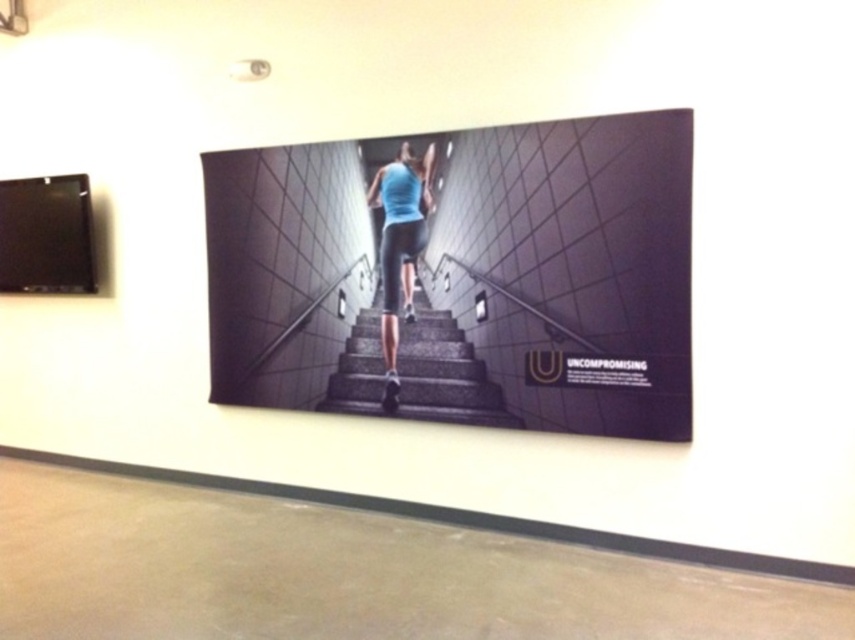
You are standing in front of the wall with the advertisement. There is a point marked at coordinate [416,371]. What object is located at that point?

The point at coordinate [416,371] indicates gray concrete stairs at center.

You are an interior designer assessing the advertisement displayed on the white wall. You notice the gray concrete stairs at center and the blue fabric leggings at center. Which object in the advertisement takes up more visual space?

The gray concrete stairs at center is bigger than blue fabric leggings at center, so the gray concrete stairs at center takes up more visual space in the advertisement.

You are an interior designer planning to place a 1.2 meter wide decorative rug in the hallway. The rug must be placed between the gray concrete stairs at center and the blue fabric leggings at center. Is there enough space for the rug?

The gray concrete stairs at center might be wider than blue fabric leggings at center, so there may be sufficient space to place a 1.2 meter wide decorative rug between them. However, the exact dimensions would need to be measured to confirm.